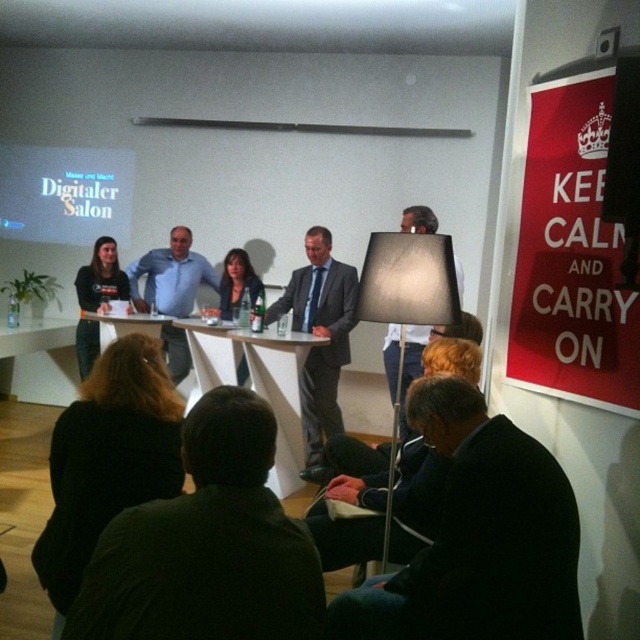
Question: Based on their relative distances, which object is nearer to the gray suit at center?

Choices:
 (A) white fabric lampshade at center
 (B) matte blue shirt at center
 (C) white glossy table at lower center

Answer: (B)

Question: Does dark green shirt at lower center appear on the left side of white glossy table at lower center?

Choices:
 (A) yes
 (B) no

Answer: (B)

Question: Where is white glossy table at center located in relation to white glossy table at lower center in the image?

Choices:
 (A) right
 (B) left

Answer: (A)

Question: Which point appears farthest from the camera in this image?

Choices:
 (A) (20, 212)
 (B) (172, 259)
 (C) (285, 525)
 (D) (337, 378)

Answer: (A)

Question: Which point is farther to the camera?

Choices:
 (A) white glossy table at lower center
 (B) white fabric lampshade at center

Answer: (A)

Question: Observing the image, what is the correct spatial positioning of white matte projection screen at upper left in reference to white fabric lampshade at center?

Choices:
 (A) left
 (B) right

Answer: (A)